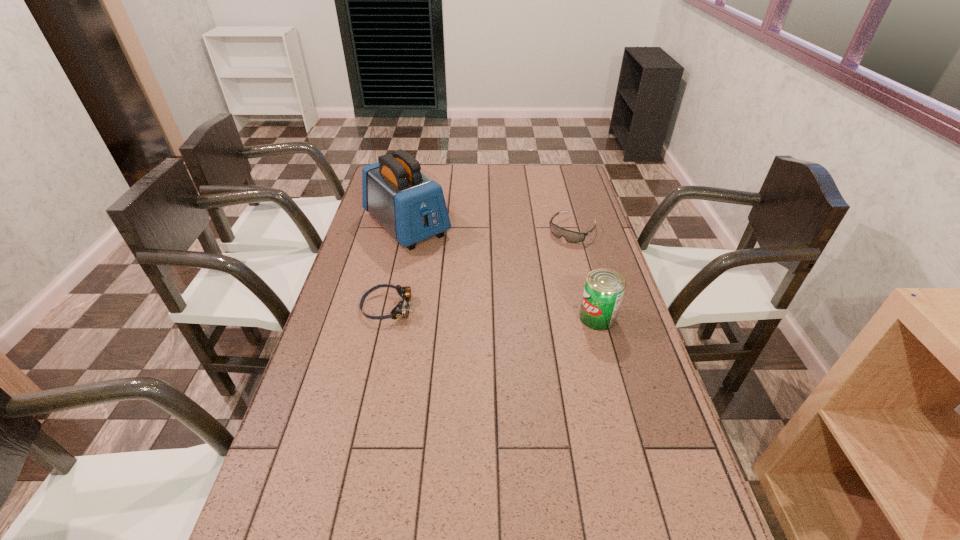
Where is `the left goggles`? The image size is (960, 540). the left goggles is located at coordinates (402, 309).

In order to click on can in this screenshot , I will do `click(604, 288)`.

Find the location of `the farther goggles`. the farther goggles is located at coordinates (570, 236).

The height and width of the screenshot is (540, 960). In order to click on toaster in this screenshot , I will do `click(411, 206)`.

You are a GUI agent. You are given a task and a screenshot of the screen. Output one action in this format:
    pyautogui.click(x=<x>, y=<y>)
    Task: Click on the free location located 0.250m on the back of the second tallest object
    
    Given the screenshot: What is the action you would take?
    pyautogui.click(x=580, y=254)

Locate an element on the screen. The height and width of the screenshot is (540, 960). vacant space located on the lenses of the farther goggles is located at coordinates click(x=542, y=264).

Find the location of `vacant space located 0.250m on the lenses of the farther goggles`. vacant space located 0.250m on the lenses of the farther goggles is located at coordinates (528, 280).

Locate an element on the screen. The image size is (960, 540). vacant space located 0.050m on the lenses of the farther goggles is located at coordinates (556, 249).

The width and height of the screenshot is (960, 540). What are the coordinates of `vacant space located 0.080m on the front-facing side of the toaster` in the screenshot? It's located at (443, 260).

This screenshot has width=960, height=540. Identify the location of vacant space located on the front-facing side of the toaster. (479, 294).